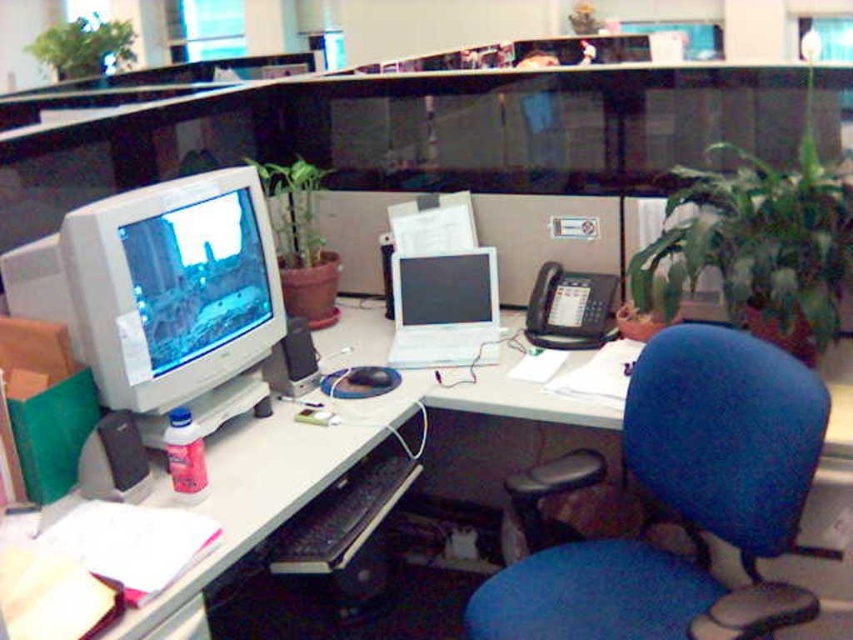
Question: Which of the following is the closest to the observer?

Choices:
 (A) matte white monitor at left
 (B) blue fabric swivel chair at center

Answer: (B)

Question: Is the position of blue fabric swivel chair at center more distant than that of black plastic keyboard at lower center?

Choices:
 (A) no
 (B) yes

Answer: (A)

Question: Estimate the real-world distances between objects in this image. Which object is farther from the green leafy plant at right?

Choices:
 (A) blue fabric swivel chair at center
 (B) black plastic keyboard at lower center
 (C) matte black monitor at center

Answer: (B)

Question: Among these objects, which one is farthest from the camera?

Choices:
 (A) white plastic desk at center
 (B) green matte plant at center
 (C) green leafy plant at upper left
 (D) matte black monitor at center

Answer: (C)

Question: Does blue fabric swivel chair at center come in front of green matte plant at center?

Choices:
 (A) no
 (B) yes

Answer: (B)

Question: Is blue fabric swivel chair at center wider than black plastic keyboard at lower center?

Choices:
 (A) no
 (B) yes

Answer: (B)